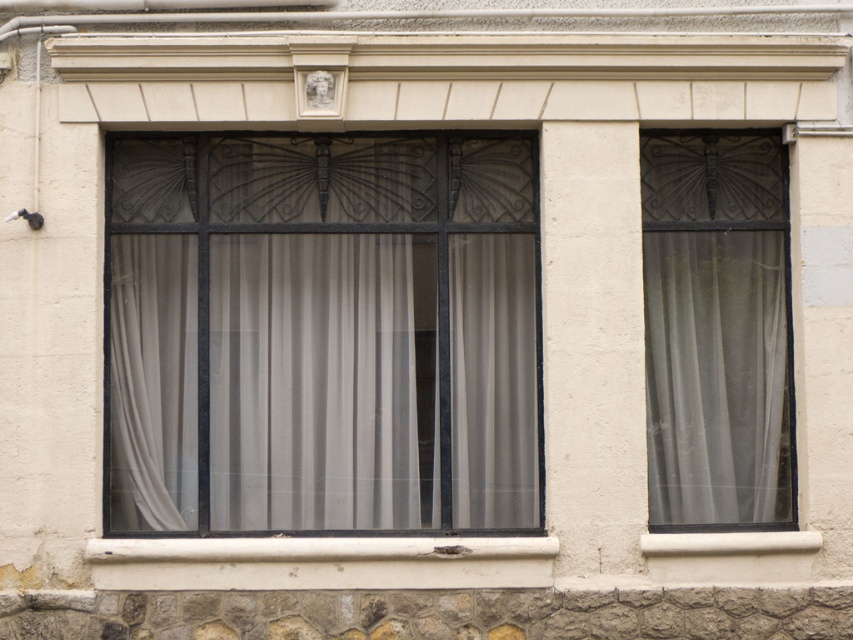
Does translucent fabric window at center appear on the right side of matte glass window at right?

No, translucent fabric window at center is not to the right of matte glass window at right.

Is translucent fabric window at center further to camera compared to matte glass window at right?

Yes, it is.

Image resolution: width=853 pixels, height=640 pixels. Find the location of `translucent fabric window at center`. translucent fabric window at center is located at coordinates (323, 333).